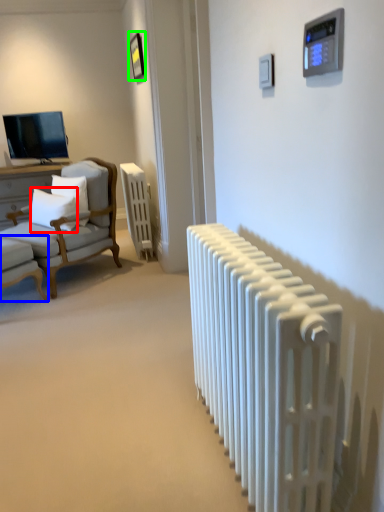
Question: Which object is positioned farthest from pillow (highlighted by a red box)? Select from chair (highlighted by a blue box) and picture frame (highlighted by a green box).

Choices:
 (A) chair
 (B) picture frame

Answer: (B)